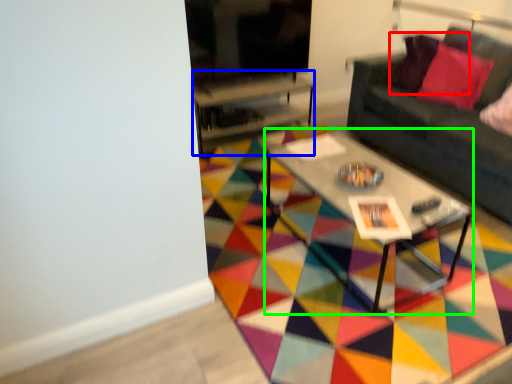
Question: Which object is positioned farthest from pillow (highlighted by a red box)? Select from table (highlighted by a blue box) and coffee table (highlighted by a green box).

Choices:
 (A) table
 (B) coffee table

Answer: (B)